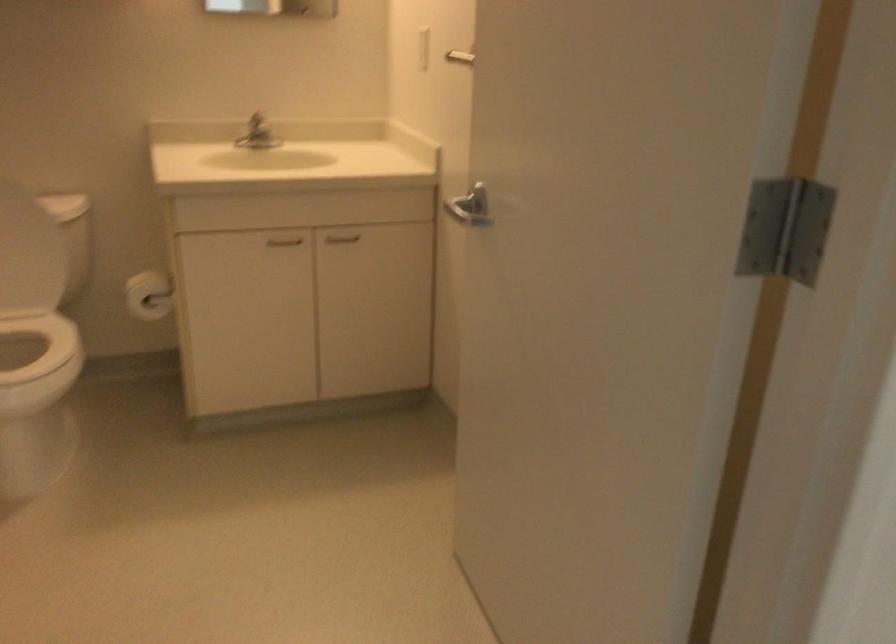
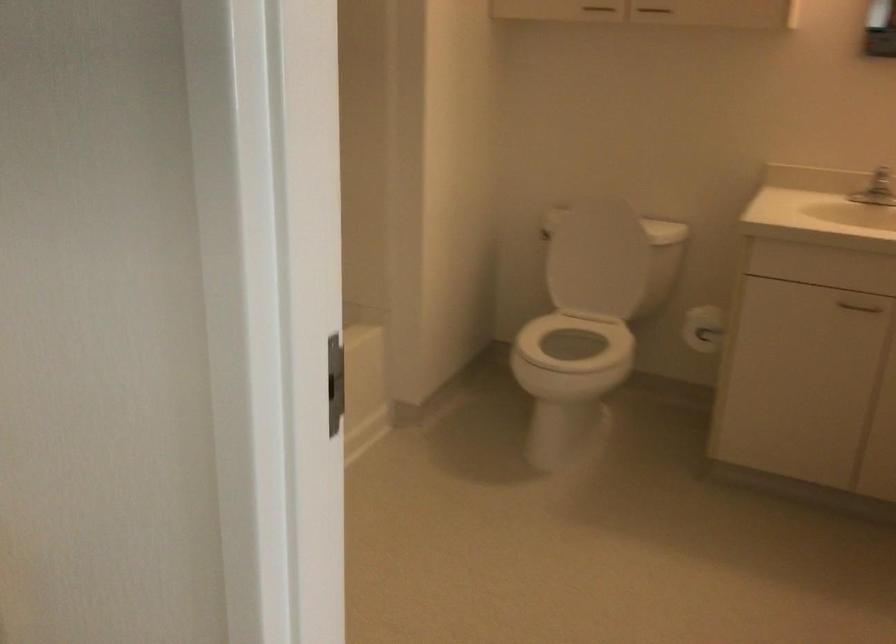
The point at [268,120] is marked in the first image. Where is the corresponding point in the second image?

(881, 182)